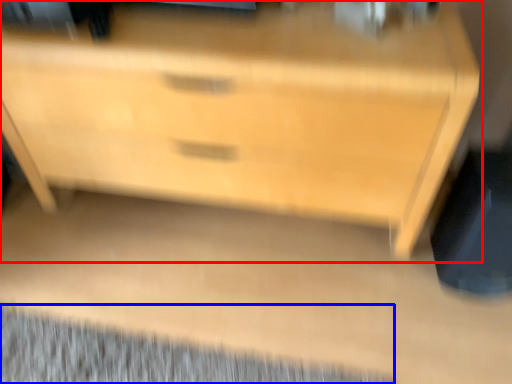
Question: Which point is further to the camera, chest of drawers (highlighted by a red box) or mat (highlighted by a blue box)?

Choices:
 (A) chest of drawers
 (B) mat

Answer: (B)